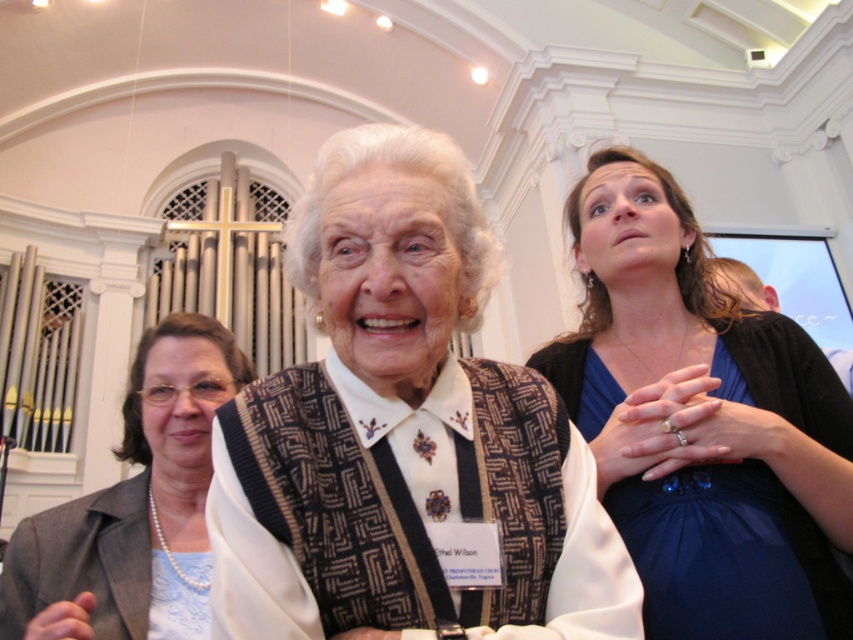
You are a photographer at this event and need to capture a clear photo of the blue satin dress at upper right without the pearl necklace at left blocking it. How can you adjust your position to achieve this?

Since the blue satin dress at upper right is in front of the pearl necklace at left, you can move to the right side to position yourself so the dress is no longer blocking the necklace, allowing both to be visible without obstruction.

You are a photographer at the event and need to capture a photo of both the blue satin dress at upper right and the pearl necklace at left in the same frame. The camera you are using has a focal length of 50mm. Given that the minimum distance between objects for clarity is 1 meter, will you be able to include both in the frame without them overlapping?

The blue satin dress at upper right is 1.38 meters away from the pearl necklace at left, which is greater than the minimum required distance of 1 meter. Therefore, you can capture both in the same frame without overlapping.

You are a photographer at the event and need to capture both the patterned fabric sweater at center and the blue satin dress at upper right in the same frame. Which clothing item will appear smaller in the photo?

The patterned fabric sweater at center will appear smaller in the photo because it has a lesser height compared to the blue satin dress at upper right.